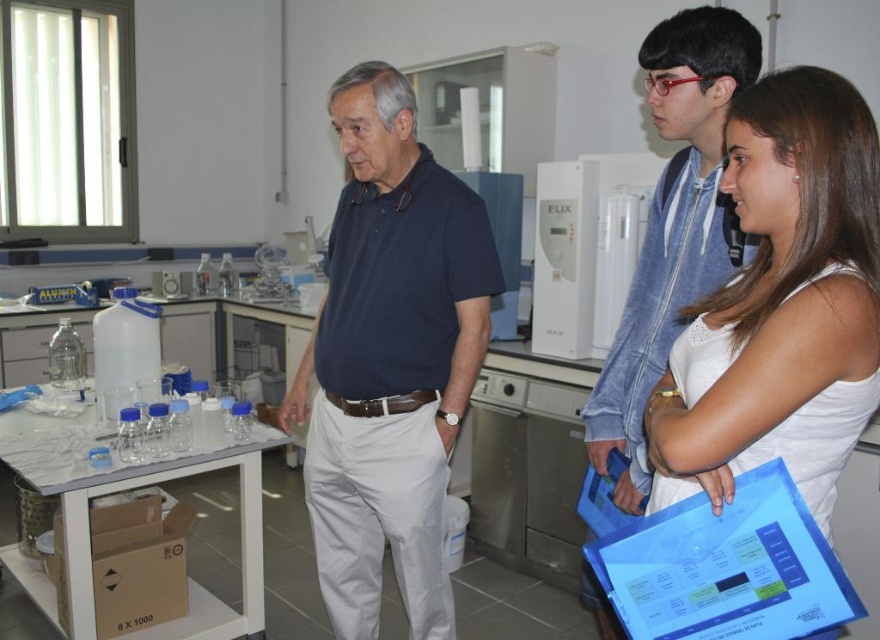
You are a fashion designer observing the laboratory scene. You need to decide which clothing item has a greater horizontal width between the dark blue cotton polo shirt at center and the white matte tank top at upper right. Based on the scene, can you determine this?

The dark blue cotton polo shirt at center might be wider than white matte tank top at upper right according to the description.

You are a researcher in the lab and need to place a 12 inch wide equipment between the dark blue cotton polo shirt at center and the white matte tank top at upper right. Is there enough space?

The distance between the dark blue cotton polo shirt at center and the white matte tank top at upper right is 32.87 inches. Since the equipment is 12 inches wide, there is sufficient space to place it between them.